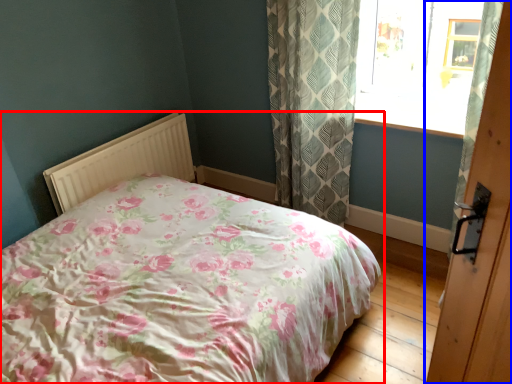
Question: Which point is closer to the camera, bed (highlighted by a red box) or door (highlighted by a blue box)?

Choices:
 (A) bed
 (B) door

Answer: (A)